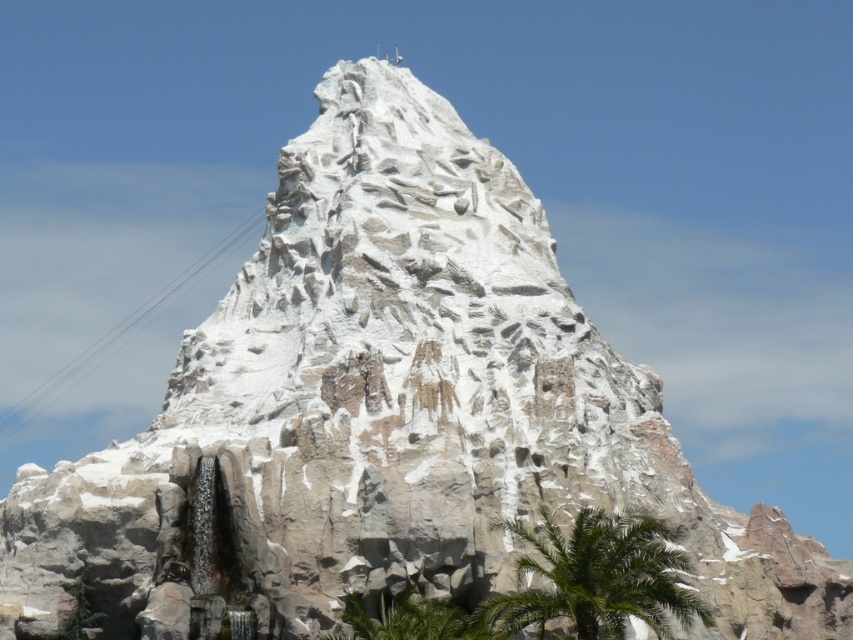
You are standing in front of the artificial mountain and want to take a photo that includes both the green leafy palm tree at lower right and the green leafy palm tree at lower center. Which palm tree should you position closer to the camera to avoid it being blocked by the other?

The green leafy palm tree at lower right is much taller than the green leafy palm tree at lower center. To avoid blocking, position the shorter green leafy palm tree at lower center closer to the camera.